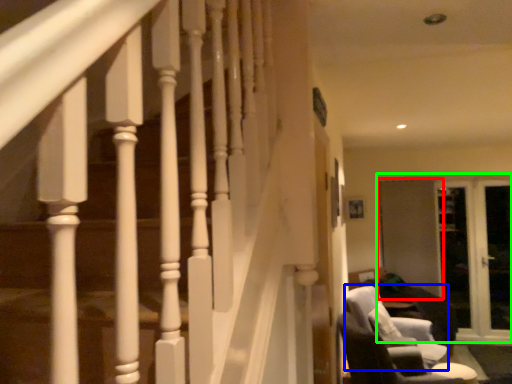
Question: Based on their relative distances, which object is farther from screen door (highlighted by a red box)? Choose from swivel chair (highlighted by a blue box) and screen door (highlighted by a green box).

Choices:
 (A) swivel chair
 (B) screen door

Answer: (A)